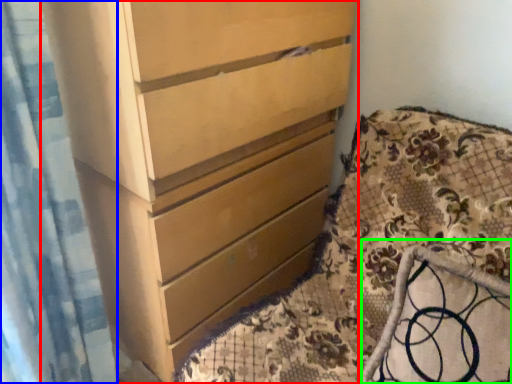
Question: Estimate the real-world distances between objects in this image. Which object is farther from chest of drawers (highlighted by a red box), shower curtain (highlighted by a blue box) or rocking chair (highlighted by a green box)?

Choices:
 (A) shower curtain
 (B) rocking chair

Answer: (B)